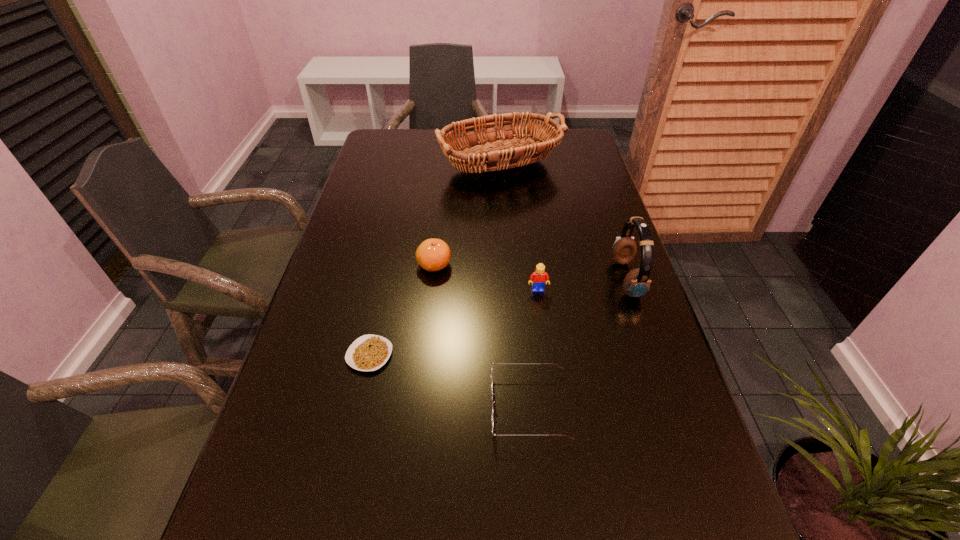
Image resolution: width=960 pixels, height=540 pixels. In order to click on vacant space positioned 0.220m on the front-facing side of the Lego in this screenshot , I will do `click(548, 370)`.

Image resolution: width=960 pixels, height=540 pixels. I want to click on vacant space located on the left of the clementine, so click(347, 265).

Where is `vacant space located on the front-facing side of the fifth tallest object`? The height and width of the screenshot is (540, 960). vacant space located on the front-facing side of the fifth tallest object is located at coordinates (287, 406).

Locate an element on the screen. vacant area situated 0.060m on the front-facing side of the fifth tallest object is located at coordinates (460, 406).

Find the location of a particular element. free region located 0.200m on the front-facing side of the fifth tallest object is located at coordinates (387, 406).

The image size is (960, 540). What are the coordinates of `vacant space located on the right of the legume` in the screenshot? It's located at (492, 355).

Locate an element on the screen. The width and height of the screenshot is (960, 540). object that is at the far edge is located at coordinates (495, 152).

I want to click on object that is at the left edge, so click(x=369, y=352).

Identify the location of basket situated at the right edge. (495, 152).

Image resolution: width=960 pixels, height=540 pixels. Find the location of `headset located in the right edge section of the desktop`. headset located in the right edge section of the desktop is located at coordinates tap(636, 283).